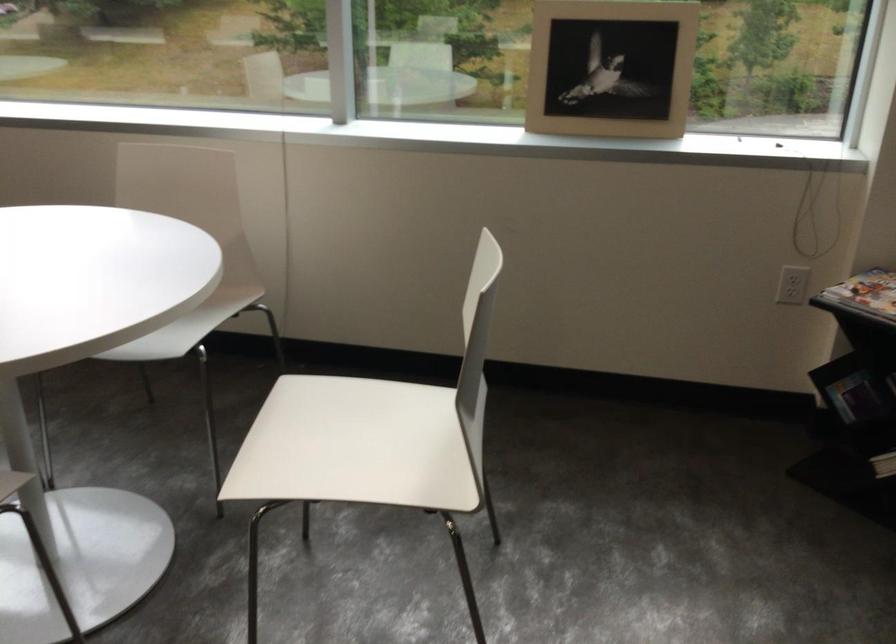
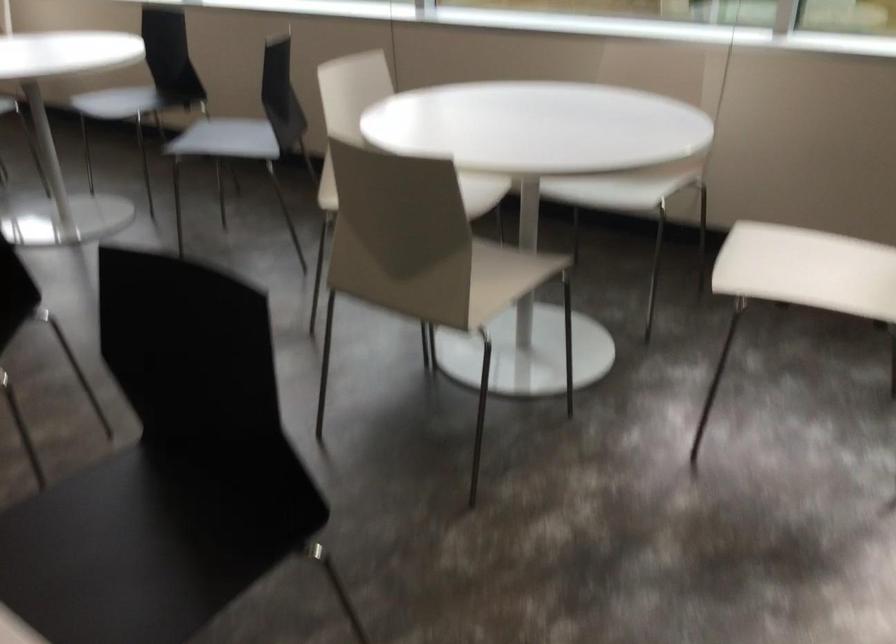
The images are taken continuously from a first-person perspective. In which direction are you moving?

The cameraman walked toward left, backward.